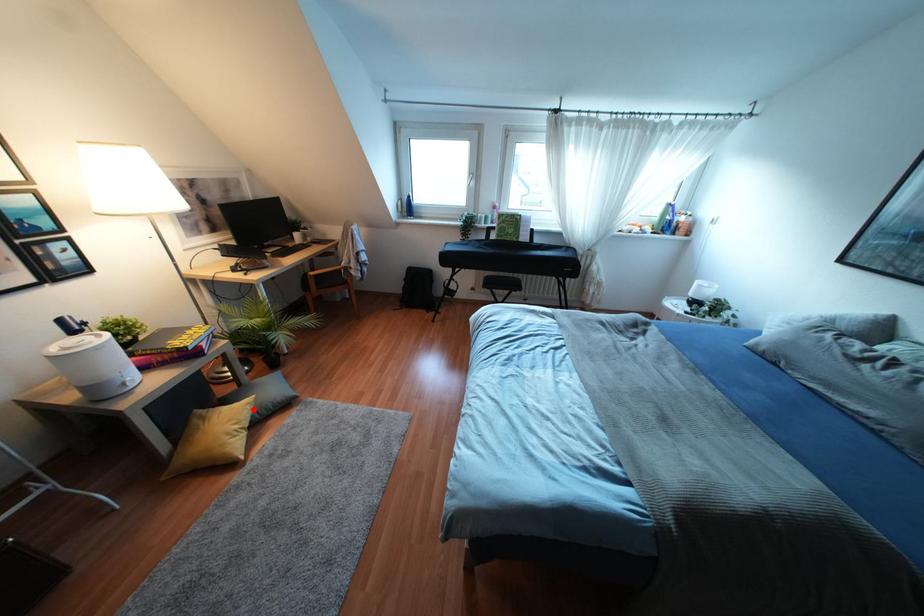
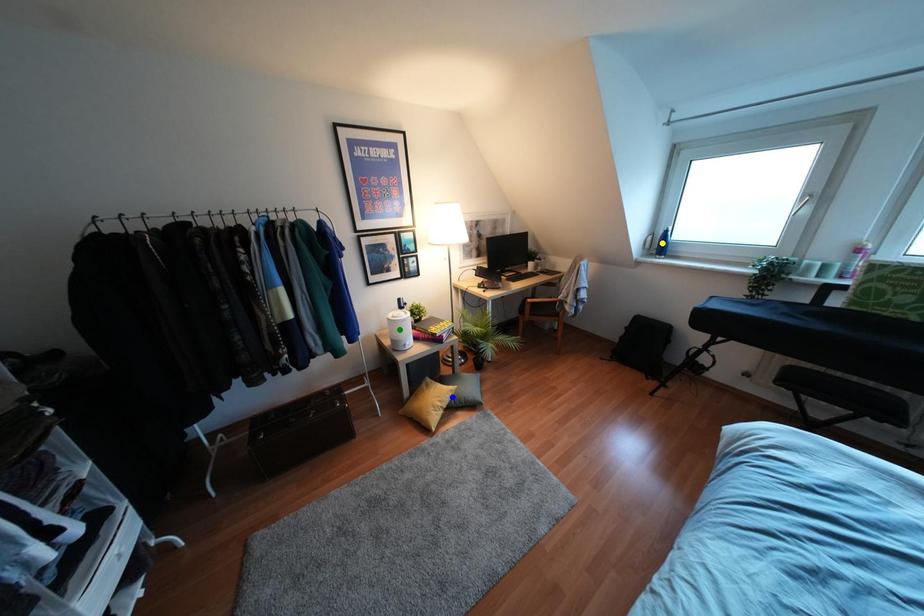
Question: I am providing you with two images of the same scene from different viewpoints. A red point is marked on the first image. You are given multiple points on the second image. Can you choose the point in image 2 that corresponds to the point in image 1?

Choices:
 (A) blue point
 (B) green point
 (C) yellow point

Answer: (A)